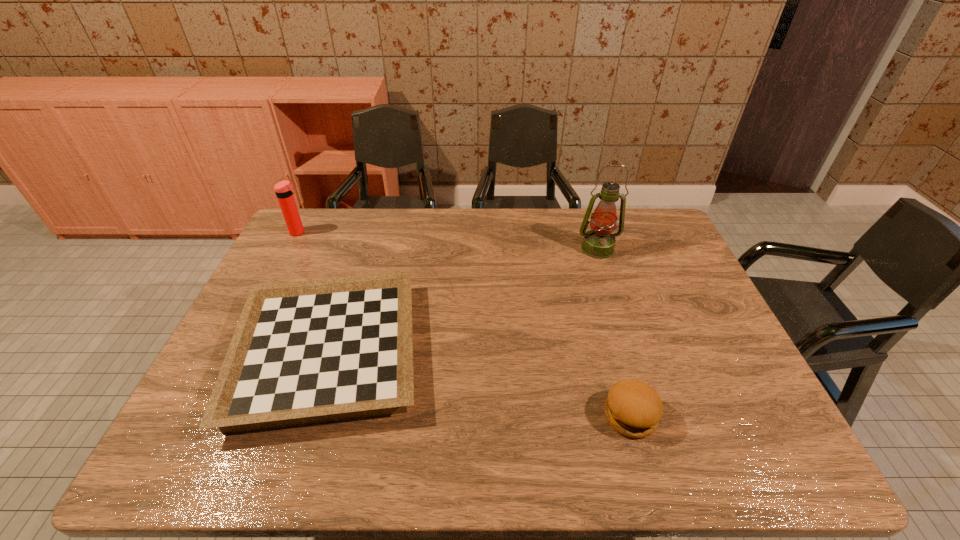
You are a GUI agent. You are given a task and a screenshot of the screen. Output one action in this format:
    pyautogui.click(x=<x>, y=<y>)
    Task: Click on the oil lamp present at the far edge
    Image resolution: width=960 pixels, height=540 pixels.
    Given the screenshot: What is the action you would take?
    pyautogui.click(x=599, y=242)

Locate an element on the screen. thermos bottle positioned at the far edge is located at coordinates (284, 190).

What are the coordinates of `hamburger located in the near edge section of the desktop` in the screenshot? It's located at (632, 408).

Identify the location of checkerboard that is at the near edge. (304, 352).

I want to click on thermos bottle that is positioned at the left edge, so click(284, 190).

You are a GUI agent. You are given a task and a screenshot of the screen. Output one action in this format:
    pyautogui.click(x=<x>, y=<y>)
    Task: Click on the checkerboard that is at the left edge
    
    Given the screenshot: What is the action you would take?
    pos(304,352)

Identify the location of object at the far left corner. (284, 190).

Identify the location of object present at the near left corner. The image size is (960, 540). (304, 352).

Find the location of `vacant space at the far edge of the desktop`. vacant space at the far edge of the desktop is located at coordinates (487, 233).

Where is `vacant point at the near edge`? vacant point at the near edge is located at coordinates (683, 440).